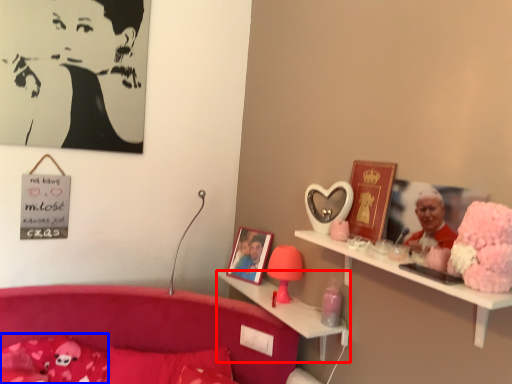
Question: Which object is closer to the camera taking this photo, shelf (highlighted by a red box) or pillow (highlighted by a blue box)?

Choices:
 (A) shelf
 (B) pillow

Answer: (B)